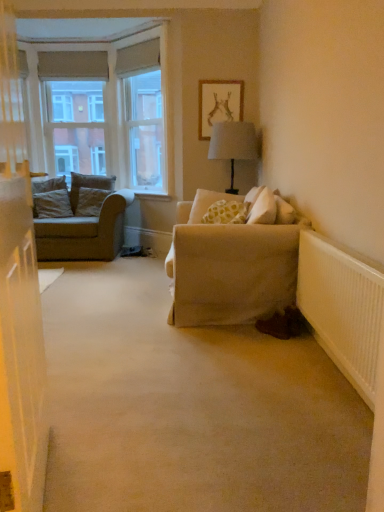
Where is `free space to the left of white ribbed radiator at lower right`? This screenshot has width=384, height=512. free space to the left of white ribbed radiator at lower right is located at coordinates (249, 388).